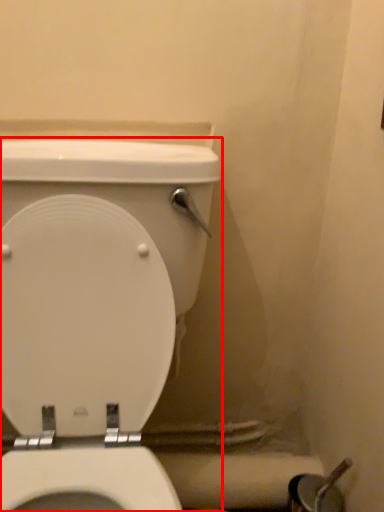
Question: From the image, what is the correct spatial relationship of toilet (annotated by the red box) in relation to toilet paper?

Choices:
 (A) right
 (B) left

Answer: (B)